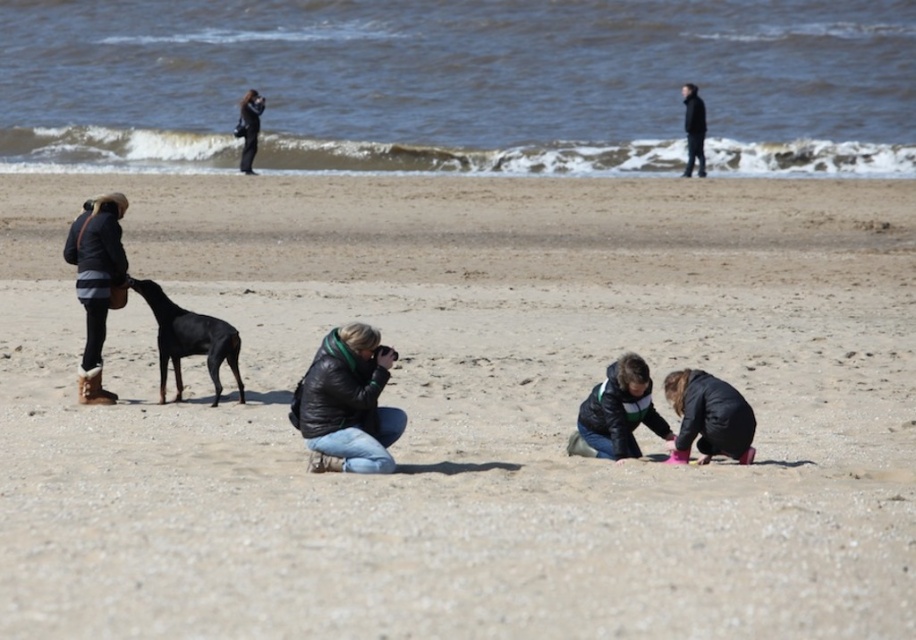
Question: Is black leather jacket at center behind black leather jacket at upper right?

Choices:
 (A) no
 (B) yes

Answer: (A)

Question: Can you confirm if fine-grained sand at center is bigger than brown leather jacket at left?

Choices:
 (A) no
 (B) yes

Answer: (B)

Question: Which object is closer to the camera taking this photo?

Choices:
 (A) black leather jacket at upper right
 (B) black leather jacket at center
 (C) fine-grained sand at center

Answer: (C)

Question: Among these objects, which one is nearest to the camera?

Choices:
 (A) dark green jacket at upper center
 (B) black leather jacket at upper right
 (C) shiny black dog at left
 (D) matte black jacket at lower right

Answer: (D)

Question: Which object appears farthest from the camera in this image?

Choices:
 (A) shiny black dog at left
 (B) brown leather jacket at left
 (C) black leather jacket at center
 (D) matte black jacket at lower right

Answer: (B)

Question: In this image, where is black leather jacket at center located relative to brown leather jacket at left?

Choices:
 (A) left
 (B) right

Answer: (B)